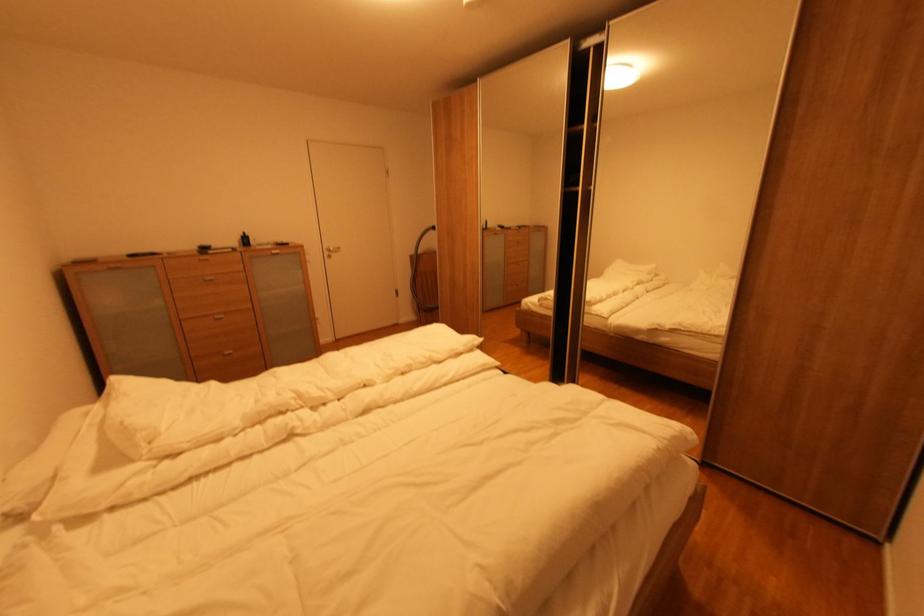
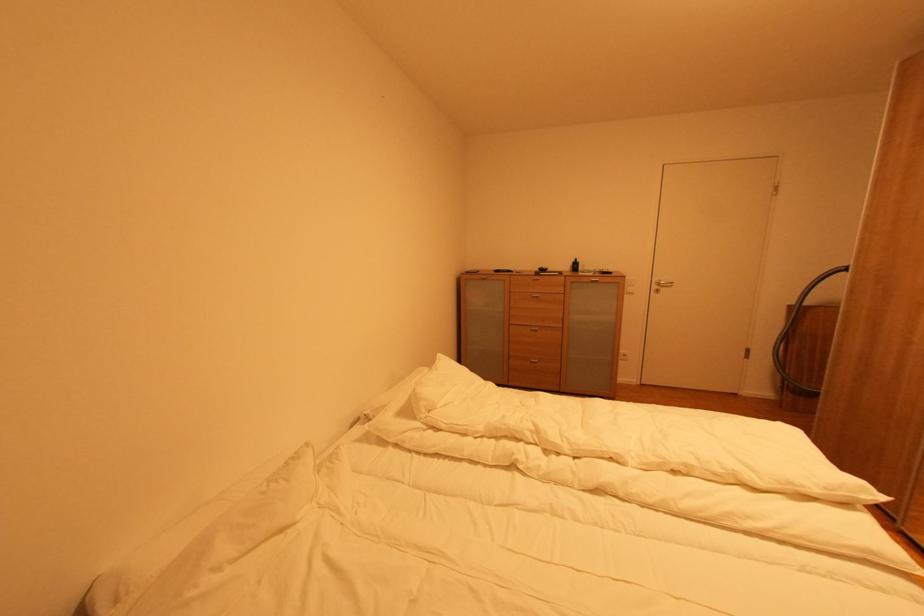
In the second image, find the point that corresponds to [333,254] in the first image.

(661, 289)